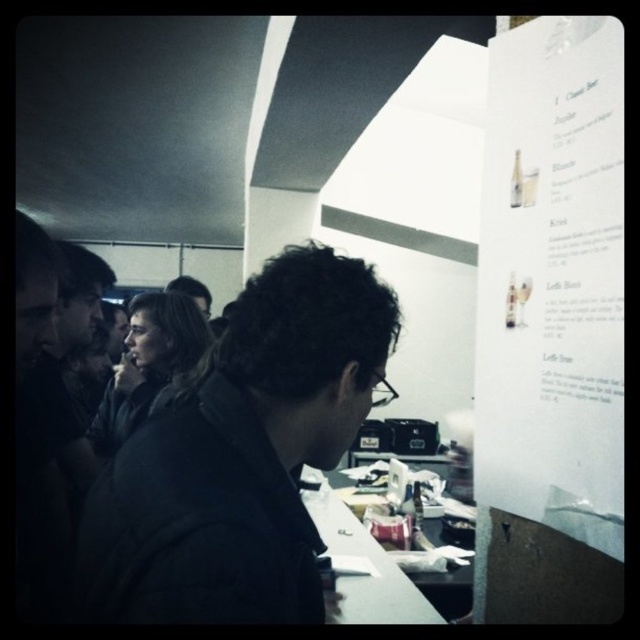
Question: Does dark fabric jacket at center appear over white paper menu at upper right?

Choices:
 (A) no
 (B) yes

Answer: (A)

Question: Is dark fabric jacket at center to the right of white paper menu at upper right from the viewer's perspective?

Choices:
 (A) no
 (B) yes

Answer: (A)

Question: Can you confirm if dark fabric jacket at center is positioned above white paper menu at upper right?

Choices:
 (A) no
 (B) yes

Answer: (A)

Question: Which point is closer to the camera taking this photo?

Choices:
 (A) (536, 285)
 (B) (332, 465)

Answer: (B)

Question: Which of the following is the closest to the observer?

Choices:
 (A) dark fabric jacket at center
 (B) white paper menu at upper right

Answer: (A)